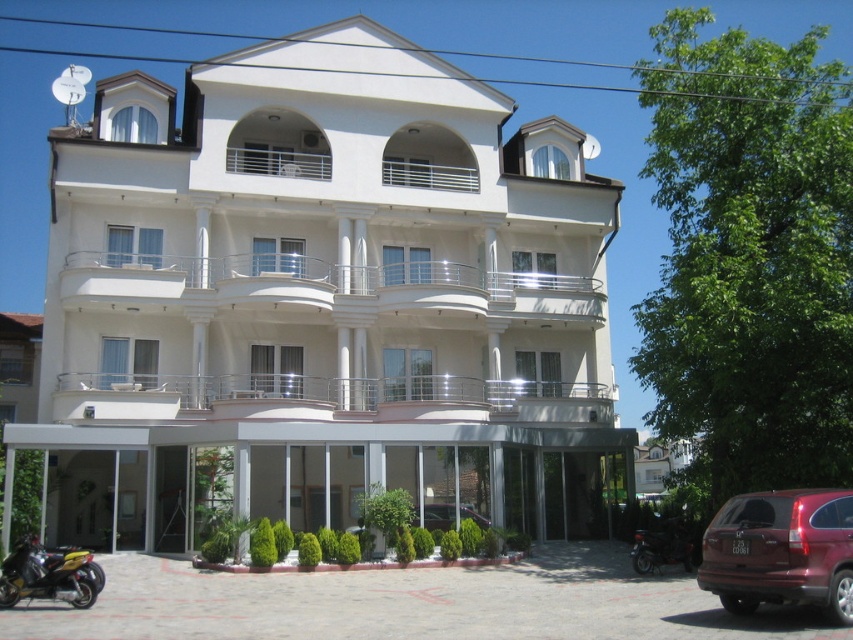
Is point (12, 604) less distant than point (642, 529)?

That is True.

Is the position of yellow matte motorbike at lower left less distant than that of shiny black motorcycle at lower right?

That is True.

At what (x,y) coordinates should I click in order to perform the action: click on yellow matte motorbike at lower left. Please return your answer as a coordinate pair (x, y). This screenshot has height=640, width=853. Looking at the image, I should click on (49, 573).

Where is `yellow matte motorbike at lower left`? This screenshot has width=853, height=640. yellow matte motorbike at lower left is located at coordinates (49, 573).

Who is positioned more to the left, yellow matte motorbike at lower left or metallic silver car at center?

From the viewer's perspective, yellow matte motorbike at lower left appears more on the left side.

Can you confirm if yellow matte motorbike at lower left is smaller than metallic silver car at center?

Incorrect, yellow matte motorbike at lower left is not smaller in size than metallic silver car at center.

Does point (24, 593) come farther from viewer compared to point (434, 515)?

No, (24, 593) is closer to viewer.

The width and height of the screenshot is (853, 640). In order to click on yellow matte motorbike at lower left in this screenshot , I will do `click(49, 573)`.

Locate an element on the screen. The height and width of the screenshot is (640, 853). maroon matte suv at lower right is located at coordinates (781, 552).

Is maroon matte suv at lower right shorter than shiny black motorcycle at lower right?

No.

Which is in front, point (805, 566) or point (682, 552)?

Point (805, 566) is in front.

You are a GUI agent. You are given a task and a screenshot of the screen. Output one action in this format:
    pyautogui.click(x=<x>, y=<y>)
    Task: Click on the maroon matte suv at lower right
    This screenshot has height=640, width=853.
    Given the screenshot: What is the action you would take?
    pyautogui.click(x=781, y=552)